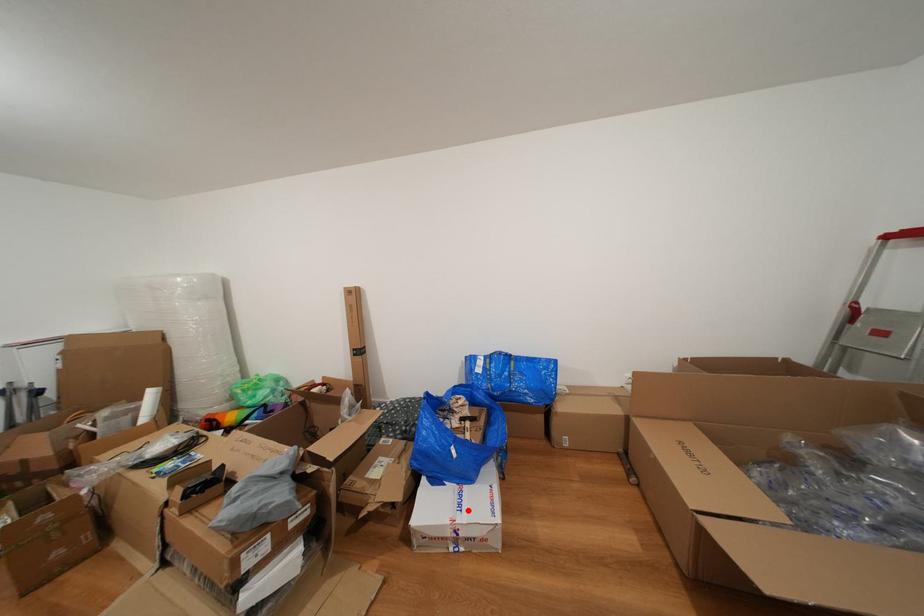
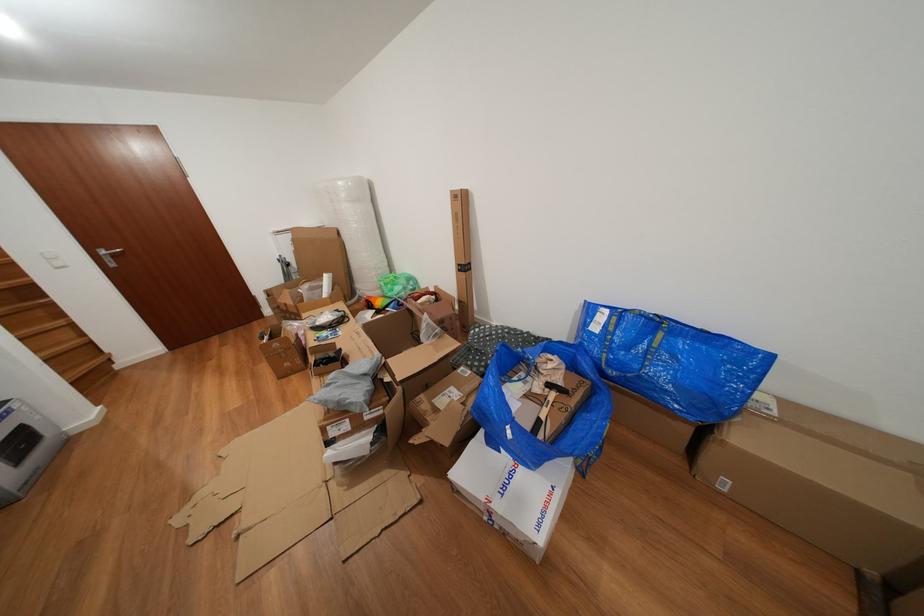
In the second image, find the point that corresponds to the highlighted location in the first image.

(513, 493)